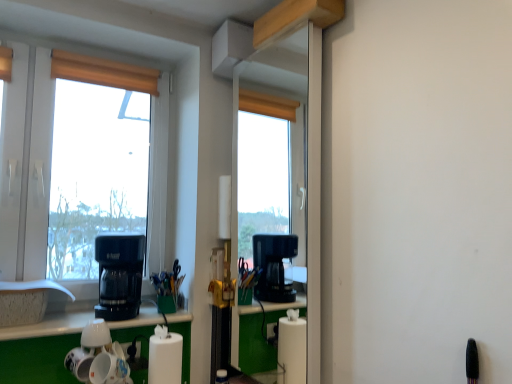
Identify the location of empty space that is ontop of white plastic window at left (from a real-world perspective). (67, 39).